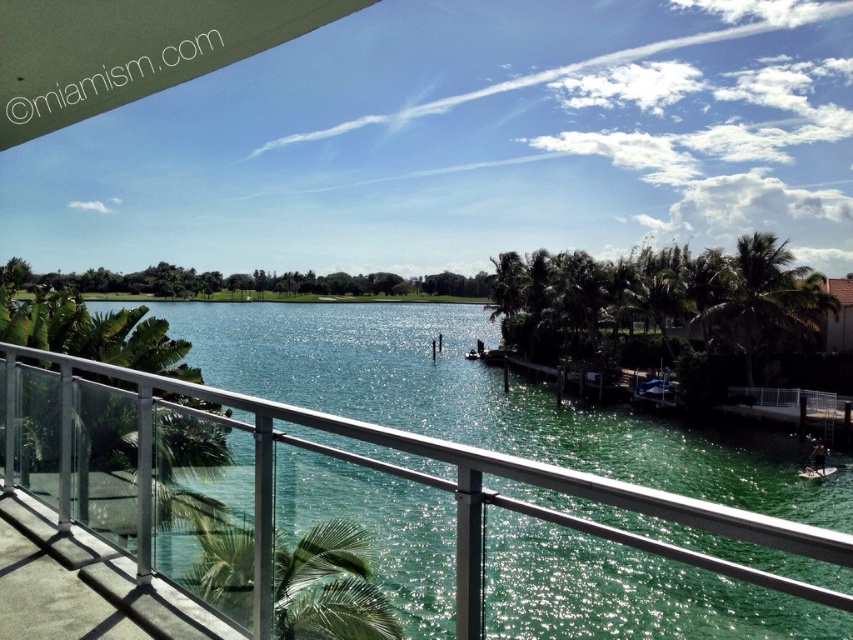
You are standing on the balcony and want to take a photo of both the green leafy palm tree at lower left and the green leafy palm tree at right. Which palm tree is positioned lower in the frame?

The green leafy palm tree at lower left is positioned lower in the frame than the green leafy palm tree at right.

You are standing on the balcony and want to place a 6 feet long bench between the clear glass railing at center and the green leafy palm tree at lower left. Will there be enough space for the bench?

The clear glass railing at center is 6.10 feet from the green leafy palm tree at lower left. Since the bench is 6 feet long, there is enough space to place it between them as the distance is slightly more than the bench length.

You are standing on the balcony and want to take a photo of the white plastic boat at lower right without including the green leafy palm tree at right in the frame. Which direction should you move to achieve this?

Move to the left to position yourself away from the green leafy palm tree at right, ensuring it is out of the photo frame while keeping the white plastic boat at lower right in view.